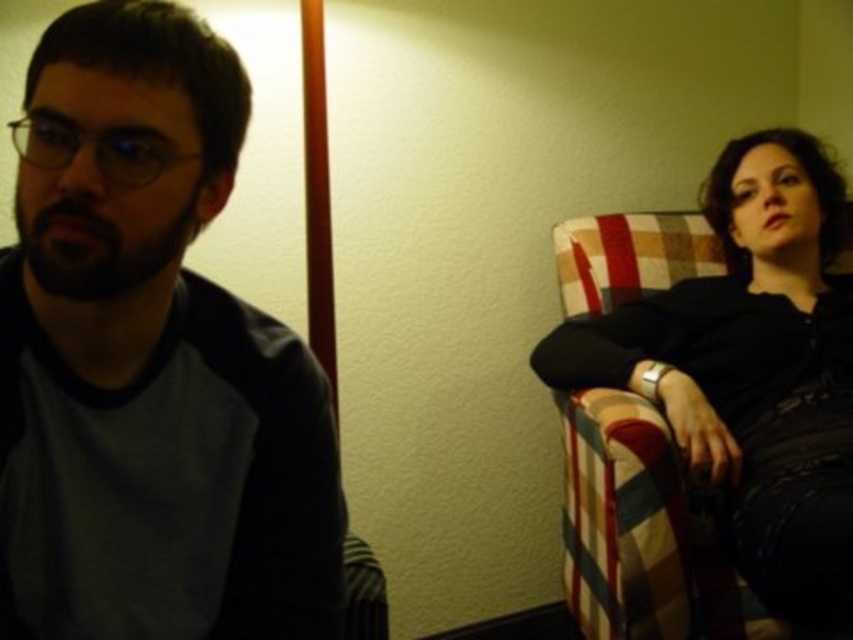
You are standing in a room and see the matte gray shirt at left. If you want to locate it on a coordinate system where the bottom left corner is the origin, what are its coordinates?

The coordinates of the matte gray shirt at left are at point (149, 362).

You are organizing a clothing donation drive and need to determine which item takes up more space. Which item is larger in size between the matte gray shirt at left and the black leather jacket at right?

The black leather jacket at right is larger than the matte gray shirt at left, so it takes up more space.